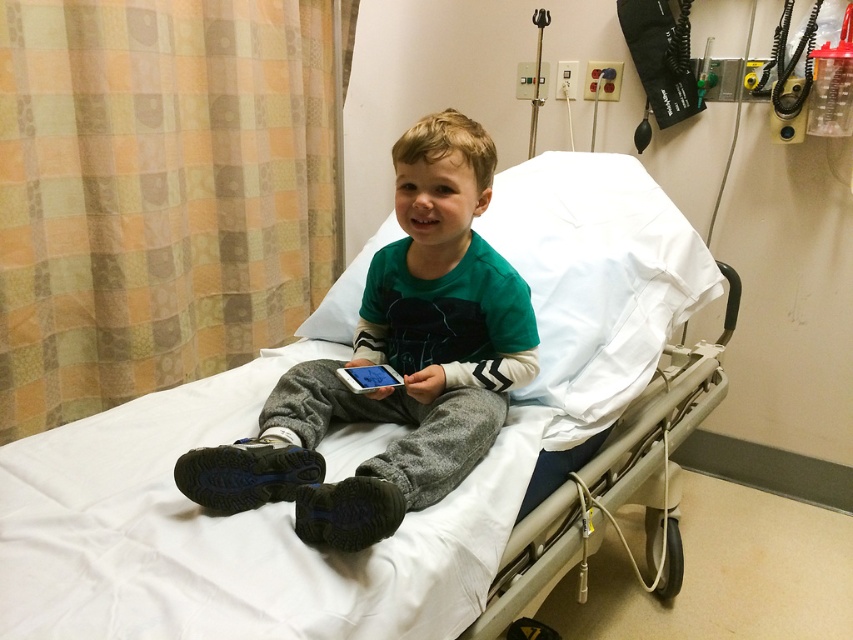
Question: Does white fabric hospital bed at center have a lesser width compared to green cotton shirt at center?

Choices:
 (A) yes
 (B) no

Answer: (B)

Question: Does white fabric hospital bed at center have a larger size compared to white glossy phone at center?

Choices:
 (A) yes
 (B) no

Answer: (A)

Question: Which point is closer to the camera?

Choices:
 (A) (401, 465)
 (B) (161, 598)
 (C) (398, 376)

Answer: (B)

Question: Which of these objects is positioned closest to the white glossy phone at center?

Choices:
 (A) white fabric hospital bed at center
 (B) green cotton shirt at center

Answer: (B)

Question: Is white fabric hospital bed at center below white glossy phone at center?

Choices:
 (A) yes
 (B) no

Answer: (B)

Question: Considering the real-world distances, which object is farthest from the white glossy phone at center?

Choices:
 (A) green cotton shirt at center
 (B) white fabric hospital bed at center

Answer: (B)